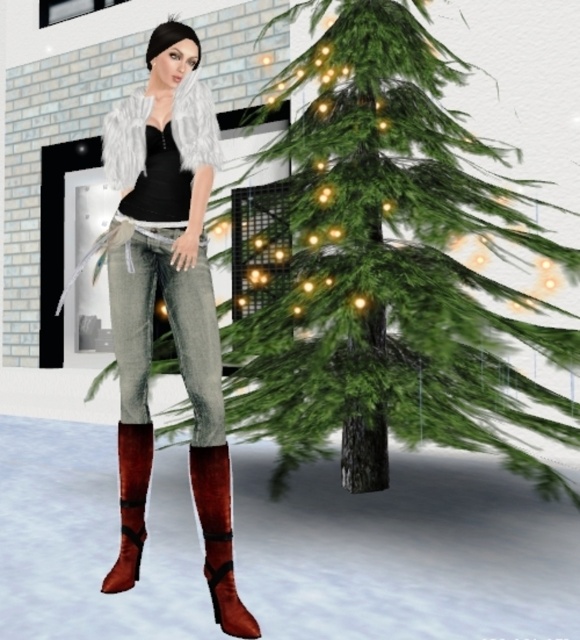
You are a photographer setting up a shot of the scene. You need to ensure that the green matte christmas tree at center and the velvet red boot at lower left are both in frame. Given that the camera has a fixed width, which object should you position closer to the camera to ensure both fit without cropping?

The green matte christmas tree at center is wider than the velvet red boot at lower left. To ensure both fit in the frame, position the green matte christmas tree at center closer to the camera. This will reduce its apparent width, allowing both objects to fit within the camera frame.

From the picture: You are an architect designing a new outdoor lighting system for the Christmas tree scene. You have two points marked on the tree that need to be lit with spotlights. The points are labeled as point 1 at coordinates point (224,445) and point 2 at coordinates point (145,480). Which point should you place the spotlight closer to the viewer to ensure proper illumination?

Point 1 at coordinates point (224,445) should be placed closer to the viewer because it is closer to the viewer than point 2 at coordinates point (145,480) according to the description.